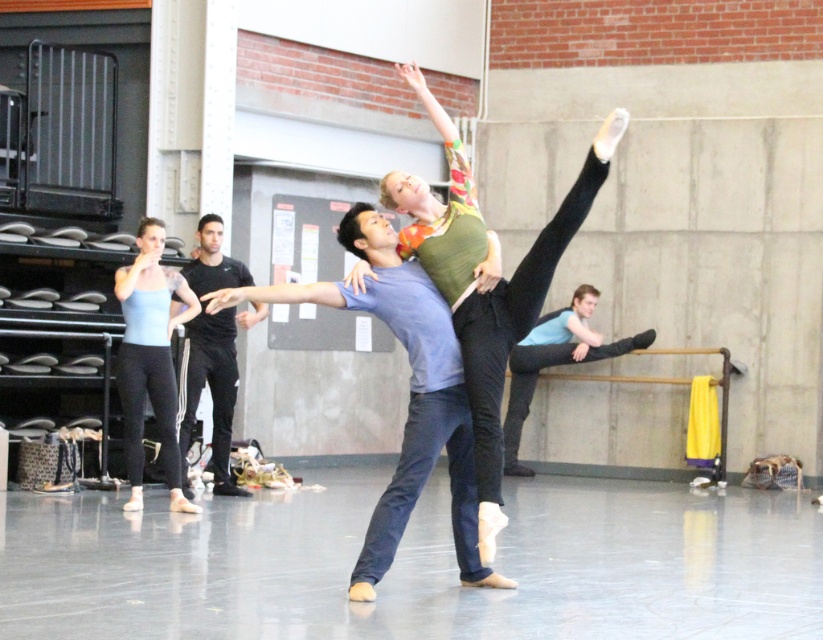
In the ballet rehearsal scene, there is a point at coordinates (408, 394). What object is located at this point?

The point at (408, 394) corresponds to the matte blue shirt at center.

You are a photographer positioned at the camera. You want to capture a closeup shot of the point at coordinates point (147, 307). Given that your camera can focus clearly on objects within 40 feet, will the point be in focus?

The distance of point (147, 307) from the camera is 43.05 feet, which is beyond the camera focus range of 40 feet. Therefore, the point will not be in focus.